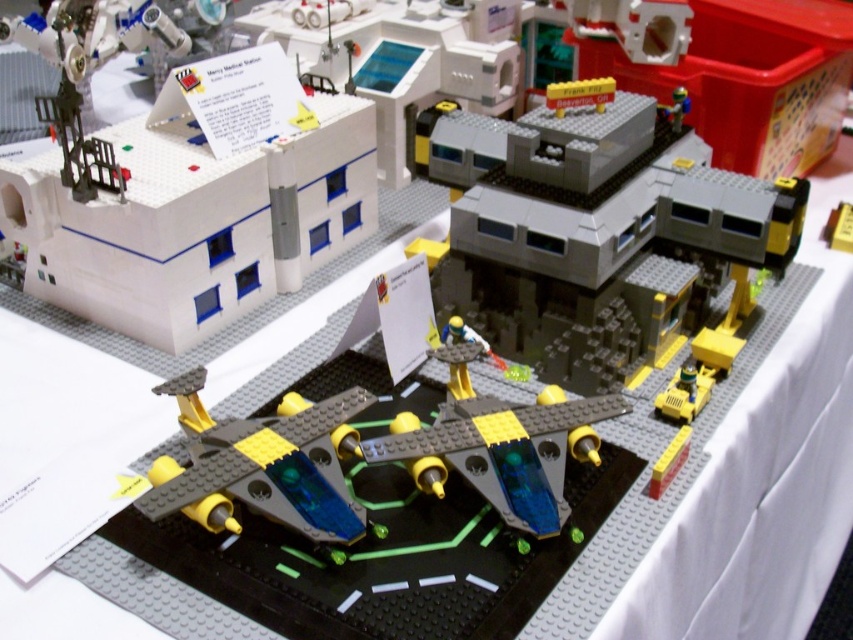
You have a small toy that needs to fit through a doorway in the LEGO scene. The doorway is exactly the width of the metallic silver robot at upper right. Can the translucent blue plastic spaceship at center pass through this doorway?

The translucent blue plastic spaceship at center is wider than the metallic silver robot at upper right. Since the doorway is the width of the metallic silver robot, the spaceship cannot pass through the doorway.

You are a visitor looking at the LEGO model. The white plastic building at upper left and the metallic silver robot at upper right are both part of the scene. Which object is taller?

The white plastic building at upper left is much taller than the metallic silver robot at upper right.

You are a delivery drone that needs to fly from the gray plastic building at center to the white plastic building at upper left. What is the minimum distance you must cover to reach your destination?

The gray plastic building at center and white plastic building at upper left are 15.12 inches apart, so the minimum distance you must cover is 15.12 inches.